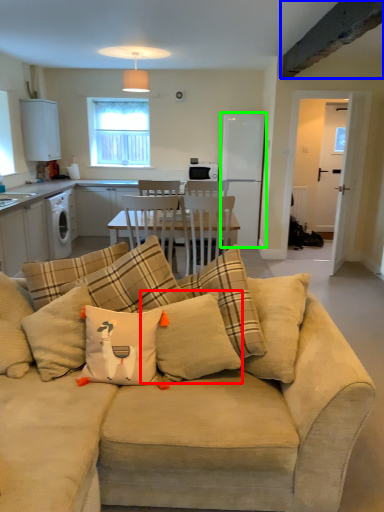
Question: Estimate the real-world distances between objects in this image. Which object is farther from pillow (highlighted by a red box), exhaust hood (highlighted by a blue box) or appliance (highlighted by a green box)?

Choices:
 (A) exhaust hood
 (B) appliance

Answer: (B)